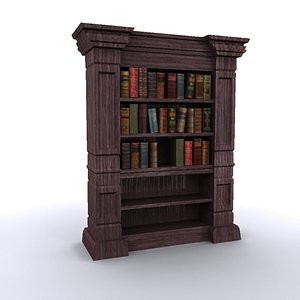
Identify the location of books on top shelf. (124, 87), (132, 82), (142, 76), (152, 83), (162, 82), (172, 80), (182, 82), (189, 81), (198, 83), (210, 81).